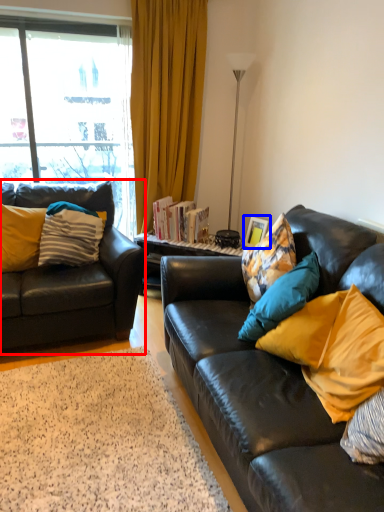
Question: Which of the following is the closest to the observer, studio couch (highlighted by a red box) or picture frame (highlighted by a blue box)?

Choices:
 (A) studio couch
 (B) picture frame

Answer: (A)